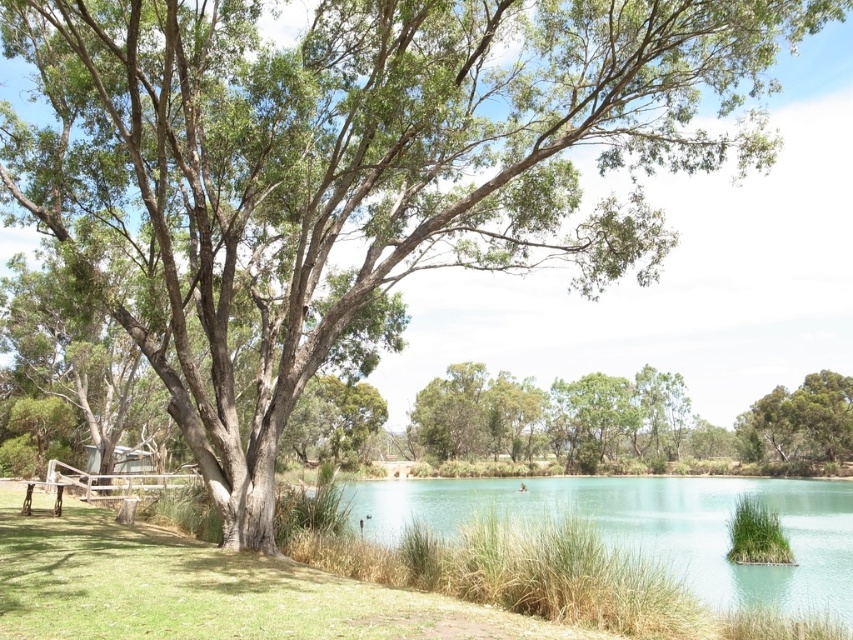
Who is lower down, clear blue water at center or green leafy tree at center?

clear blue water at center is lower down.

Does clear blue water at center come in front of green leafy tree at center?

Yes, it is.

Who is more forward, (843, 509) or (820, 394)?

Point (843, 509) is more forward.

This screenshot has height=640, width=853. Identify the location of clear blue water at center. (650, 525).

Who is higher up, clear blue water at center or green grass at lower right?

green grass at lower right

Is point (473, 492) positioned in front of point (749, 540)?

No, it is behind (749, 540).

At what (x,y) coordinates should I click in order to perform the action: click on clear blue water at center. Please return your answer as a coordinate pair (x, y). The width and height of the screenshot is (853, 640). Looking at the image, I should click on (650, 525).

Is green leafy tree at center to the right of green grass at lower right from the viewer's perspective?

Correct, you'll find green leafy tree at center to the right of green grass at lower right.

Locate an element on the screen. This screenshot has width=853, height=640. green leafy tree at center is located at coordinates (799, 420).

Does point (839, 426) come behind point (763, 506)?

Yes.

This screenshot has width=853, height=640. What are the coordinates of `green leafy tree at center` in the screenshot? It's located at (799, 420).